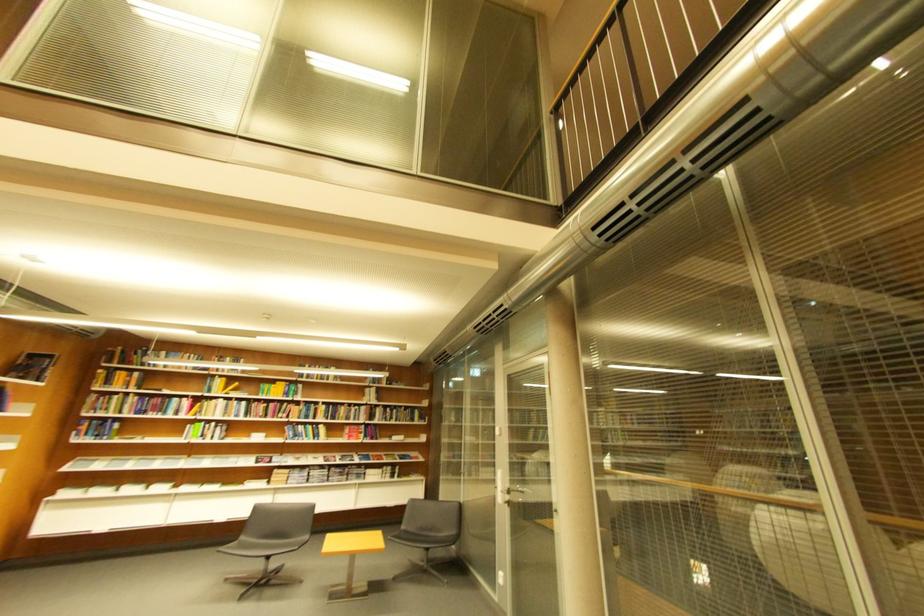
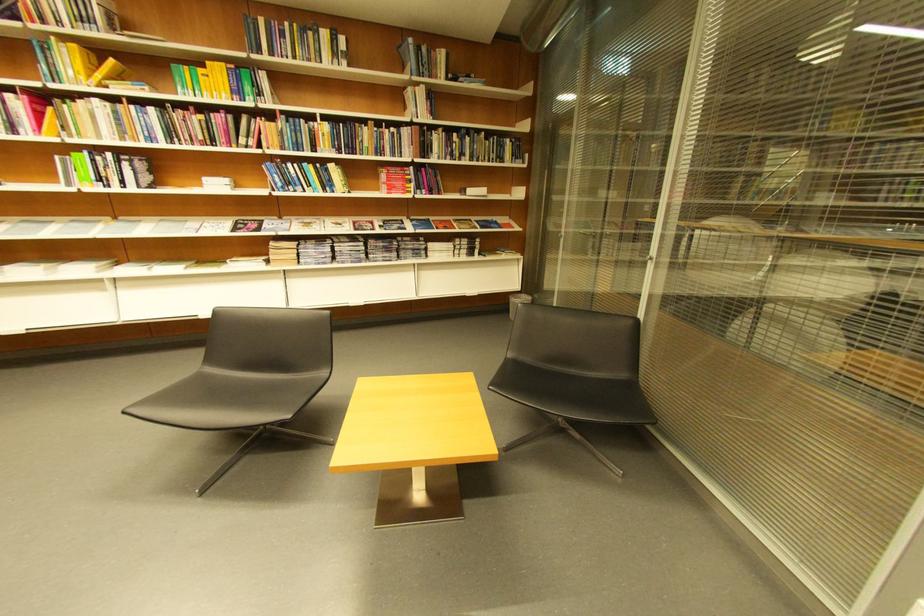
Find the pixel in the second image that matches the point at 362,429 in the first image.

(403, 172)